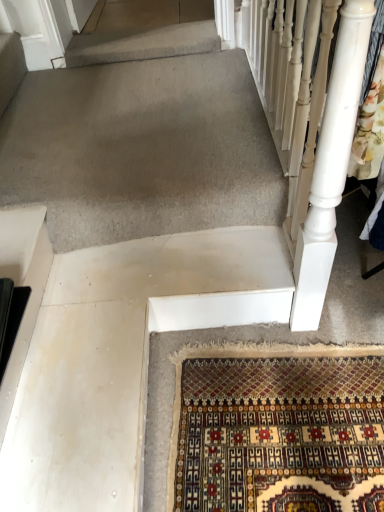
Question: Is black plastic at left bigger or smaller than white painted wood at right?

Choices:
 (A) big
 (B) small

Answer: (B)

Question: Is black plastic at left taller or shorter than white painted wood at right?

Choices:
 (A) tall
 (B) short

Answer: (B)

Question: Is black plastic at left situated inside white painted wood at right or outside?

Choices:
 (A) outside
 (B) inside

Answer: (A)

Question: In terms of height, does white painted wood at right look taller or shorter compared to black plastic at left?

Choices:
 (A) tall
 (B) short

Answer: (A)

Question: Considering the positions of white painted wood at right and black plastic at left in the image, is white painted wood at right wider or thinner than black plastic at left?

Choices:
 (A) thin
 (B) wide

Answer: (A)

Question: Is white painted wood at right in front of or behind black plastic at left in the image?

Choices:
 (A) behind
 (B) front

Answer: (B)

Question: From a real-world perspective, is white painted wood at right physically located above or below black plastic at left?

Choices:
 (A) above
 (B) below

Answer: (A)